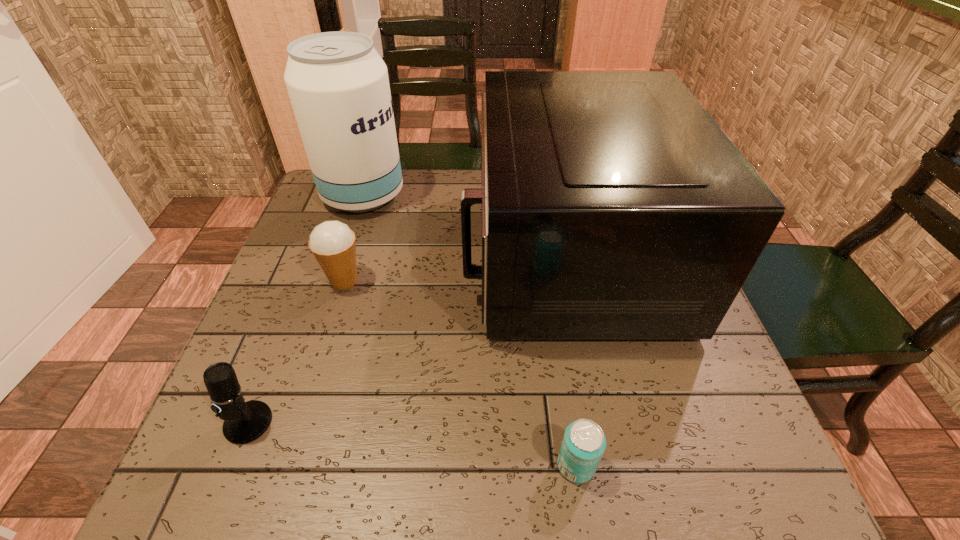
At what (x,y) coordinates should I click in order to perform the action: click on free spot between the tallest object and the fourth farthest object. Please return your answer as a coordinate pair (x, y). Looking at the image, I should click on (306, 309).

Where is `free space between the icecream and the second tallest object`? The image size is (960, 540). free space between the icecream and the second tallest object is located at coordinates (455, 268).

Identify the location of vacant space in between the alcohol and the nearest object. (469, 330).

The image size is (960, 540). I want to click on free space between the beer can and the fourth farthest object, so click(412, 444).

Image resolution: width=960 pixels, height=540 pixels. I want to click on free space that is in between the icecream and the microphone, so point(297,352).

Image resolution: width=960 pixels, height=540 pixels. In order to click on vacant region between the alcohol and the second nearest object in this screenshot , I will do `click(306, 309)`.

Find the location of `the second closest object to the second nearest object`. the second closest object to the second nearest object is located at coordinates (613, 206).

This screenshot has width=960, height=540. In order to click on object that stands as the closest to the microwave_oven in this screenshot , I will do `click(338, 84)`.